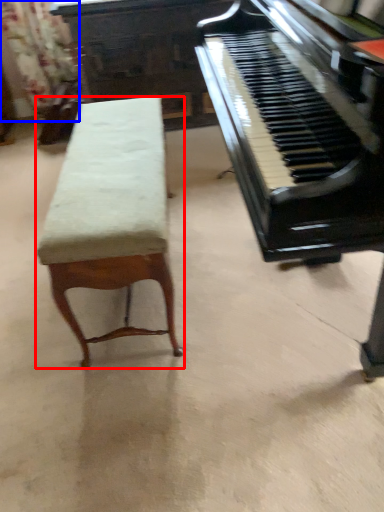
Question: Which object is further to the camera taking this photo, furniture (highlighted by a red box) or curtain (highlighted by a blue box)?

Choices:
 (A) furniture
 (B) curtain

Answer: (B)